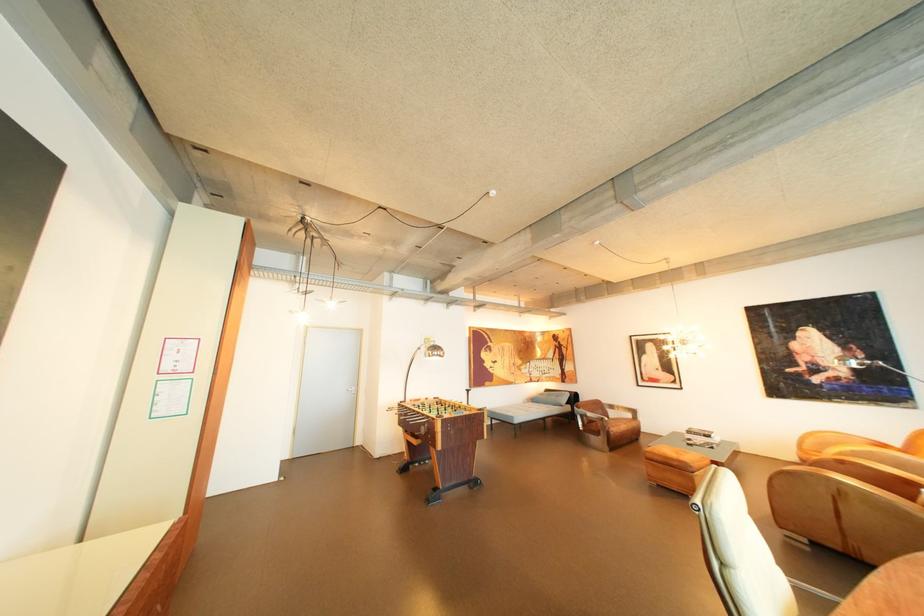
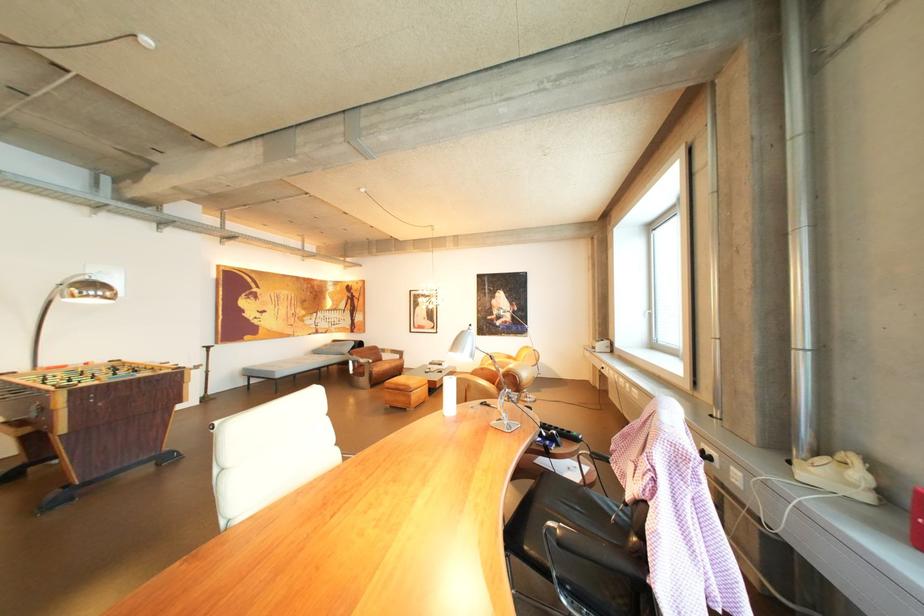
The point at (526, 418) is marked in the first image. Where is the corresponding point in the second image?

(286, 373)